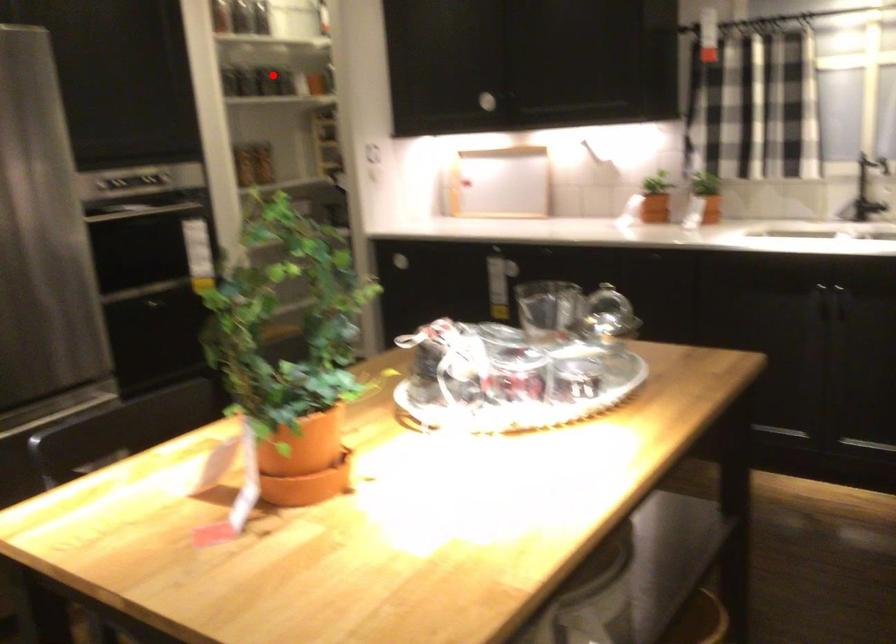
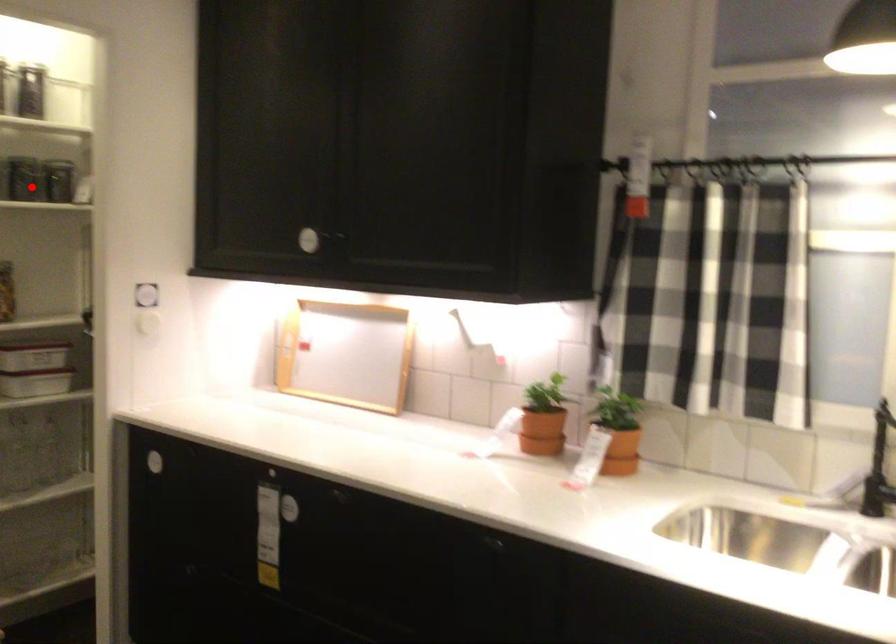
I am providing you with two images of the same scene from different viewpoints. A red point is marked on the first image and another point is marked on the second image. Do the highlighted points in image1 and image2 indicate the same real-world spot?

Yes